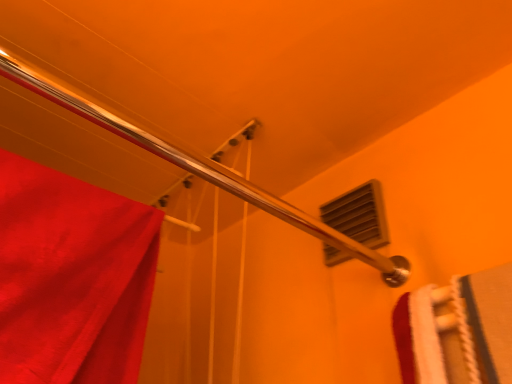
Question: In terms of width, does shiny metallic shower at upper left look wider or thinner when compared to matte plastic vent at upper right?

Choices:
 (A) thin
 (B) wide

Answer: (B)

Question: Is point (51, 84) closer or farther from the camera than point (340, 200)?

Choices:
 (A) closer
 (B) farther

Answer: (A)

Question: From their relative heights in the image, would you say shiny metallic shower at upper left is taller or shorter than matte plastic vent at upper right?

Choices:
 (A) tall
 (B) short

Answer: (B)

Question: Is matte plastic vent at upper right wider or thinner than shiny metallic shower at upper left?

Choices:
 (A) thin
 (B) wide

Answer: (A)

Question: From the image's perspective, is matte plastic vent at upper right located above or below shiny metallic shower at upper left?

Choices:
 (A) above
 (B) below

Answer: (B)

Question: Based on their positions, is matte plastic vent at upper right located to the left or right of shiny metallic shower at upper left?

Choices:
 (A) left
 (B) right

Answer: (B)

Question: In terms of height, does matte plastic vent at upper right look taller or shorter compared to shiny metallic shower at upper left?

Choices:
 (A) short
 (B) tall

Answer: (B)